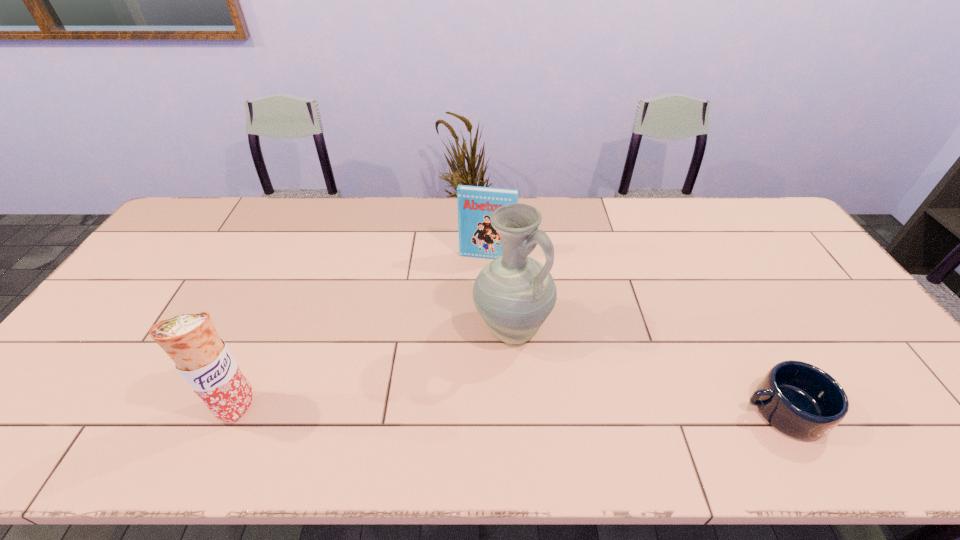
Locate an element on the screen. vacant space located 0.100m with the handle on the side of the shortest object is located at coordinates (699, 410).

Image resolution: width=960 pixels, height=540 pixels. What are the coordinates of `vacant space located with the handle on the side of the shortest object` in the screenshot? It's located at [588, 410].

I want to click on vacant space located 0.230m on the front cover of the farthest object, so click(471, 316).

You are a GUI agent. You are given a task and a screenshot of the screen. Output one action in this format:
    pyautogui.click(x=<x>, y=<y>)
    Task: Click on the vacant region located 0.220m on the front cover of the farthest object
    The image size is (960, 540).
    Given the screenshot: What is the action you would take?
    pyautogui.click(x=471, y=313)

Identify the location of free space located 0.240m on the front cover of the farthest object. (470, 319).

Find the location of `vacant region located 0.050m on the handle side of the second farthest object`. vacant region located 0.050m on the handle side of the second farthest object is located at coordinates (538, 374).

Where is `vacant area situated 0.160m on the handle side of the second farthest object`? The width and height of the screenshot is (960, 540). vacant area situated 0.160m on the handle side of the second farthest object is located at coordinates (560, 411).

Identify the location of vacant space located on the handle side of the second farthest object. This screenshot has width=960, height=540. (540, 377).

Identify the location of burrito that is at the near edge. pos(202,358).

You are a GUI agent. You are given a task and a screenshot of the screen. Output one action in this format:
    pyautogui.click(x=<x>, y=<y>)
    Task: Click on the mug present at the near edge
    This screenshot has height=540, width=960.
    Given the screenshot: What is the action you would take?
    pyautogui.click(x=800, y=400)